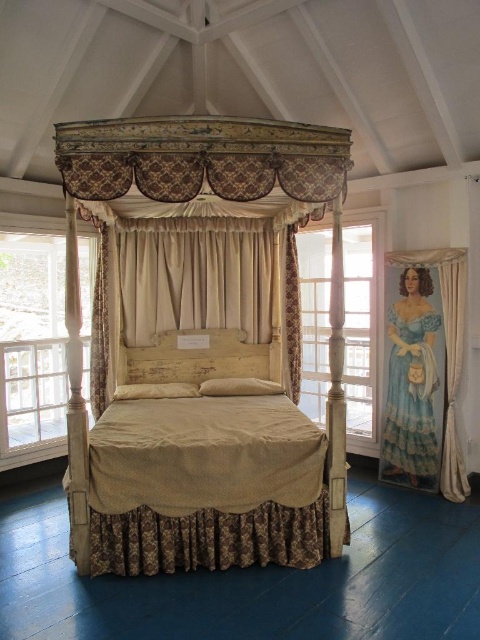
Question: Which of the following is the closest to the observer?

Choices:
 (A) (377, 268)
 (B) (446, 300)

Answer: (B)

Question: Which object is closer to the camera taking this photo?

Choices:
 (A) wooden canopy bed at center
 (B) beige fabric curtain at right

Answer: (A)

Question: Observing the image, what is the correct spatial positioning of beige fabric curtain at center in reference to clear glass window at center?

Choices:
 (A) left
 (B) right

Answer: (A)

Question: Is the position of wooden canopy bed at center less distant than that of white wood window at left?

Choices:
 (A) yes
 (B) no

Answer: (A)

Question: Which of the following is the farthest from the observer?

Choices:
 (A) white wood window at left
 (B) blue silk dress at right
 (C) clear glass window at center
 (D) wooden canopy bed at center

Answer: (C)

Question: From the image, what is the correct spatial relationship of white wood window at left in relation to beige fabric curtain at right?

Choices:
 (A) left
 (B) right

Answer: (A)